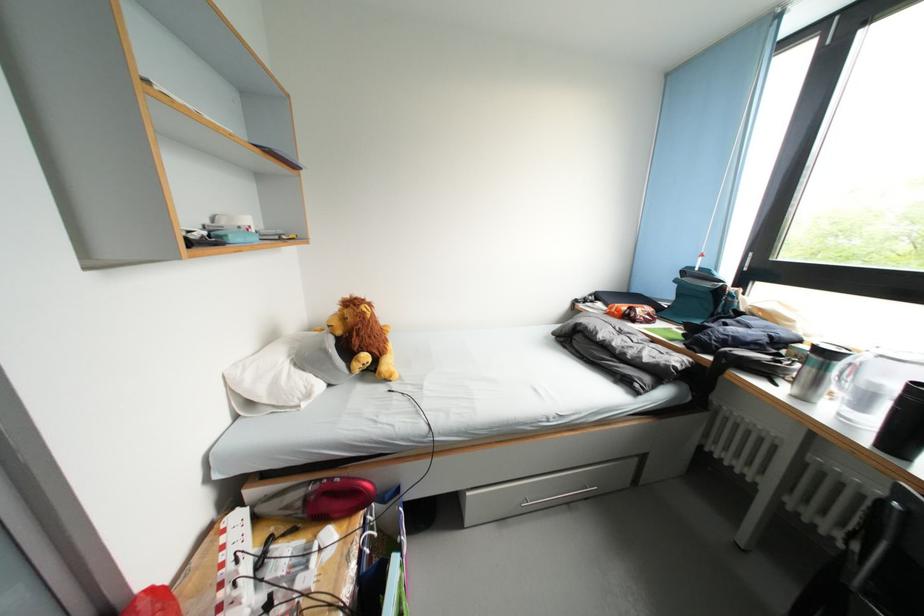
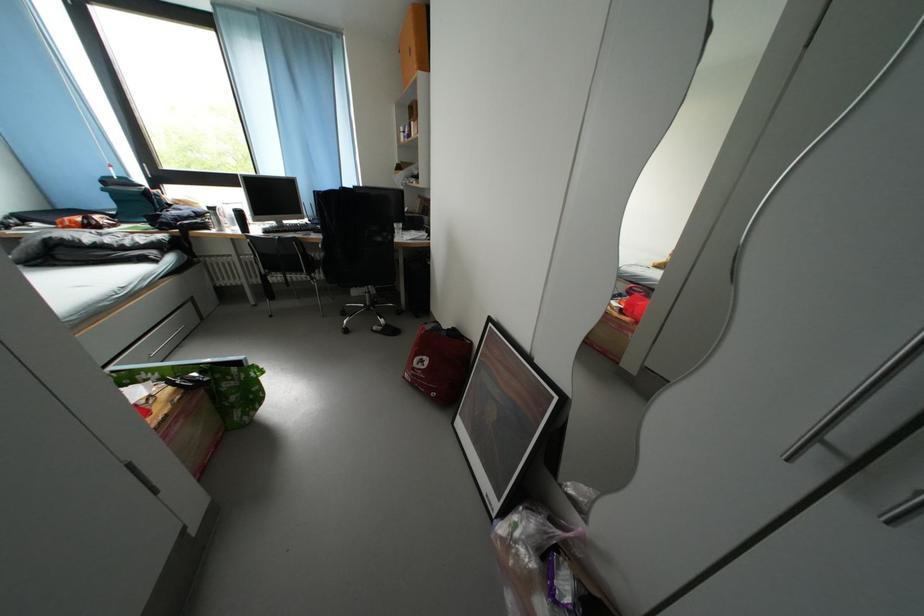
In the second image, find the point that corresponds to point 872,446 in the first image.

(248, 238)